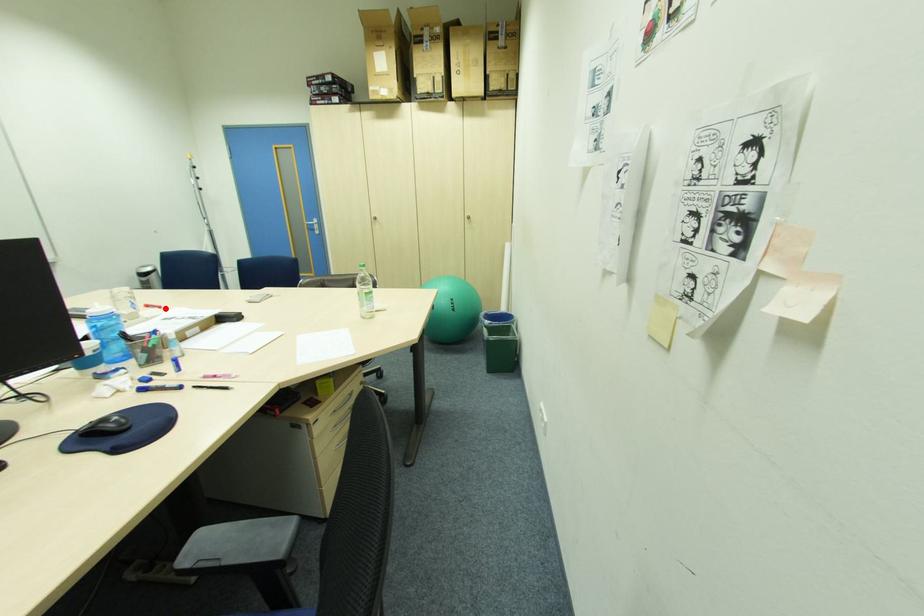
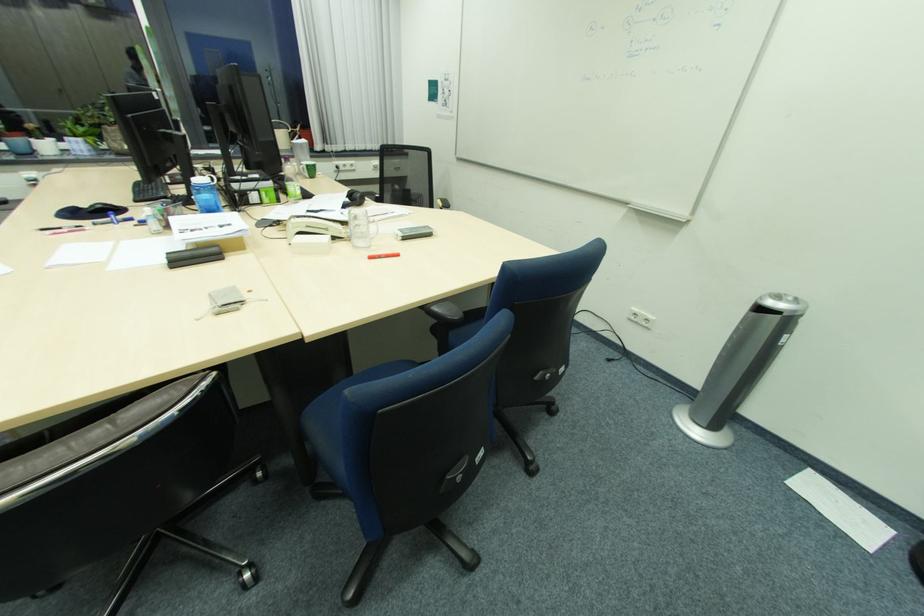
Locate, in the second image, the point that corresponds to the highlighted location in the first image.

(377, 257)